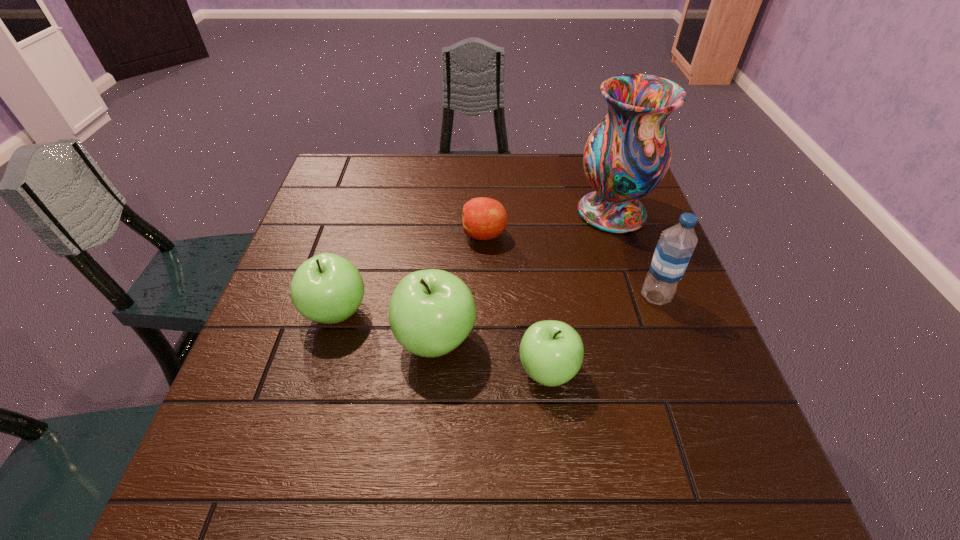
The width and height of the screenshot is (960, 540). Find the location of `vacant space at the far edge of the desktop`. vacant space at the far edge of the desktop is located at coordinates (492, 180).

In the image, there is a desktop. Where is `vacant space at the near edge`? vacant space at the near edge is located at coordinates (406, 416).

The height and width of the screenshot is (540, 960). What are the coordinates of `free space at the left edge of the desktop` in the screenshot? It's located at (315, 207).

Identify the location of blank space at the near left corner. (287, 418).

The height and width of the screenshot is (540, 960). What are the coordinates of `free space at the near right corner` in the screenshot? It's located at (686, 436).

Find the location of a particular element. The height and width of the screenshot is (540, 960). vacant area that lies between the water bottle and the rightmost apple is located at coordinates (602, 334).

The width and height of the screenshot is (960, 540). In order to click on unoccupied position between the leftmost apple and the tallest object in this screenshot , I will do `click(474, 262)`.

The image size is (960, 540). I want to click on vacant region between the third object from right to left and the vase, so click(x=580, y=292).

At what (x,y) coordinates should I click in order to perform the action: click on object that is the nearest to the fourth object from left to right. Please return your answer as a coordinate pair (x, y). Looking at the image, I should click on (431, 312).

Select which object appears as the closest to the fourth object from left to right. Please provide its 2D coordinates. Your answer should be formatted as a tuple, i.e. [(x, y)], where the tuple contains the x and y coordinates of a point satisfying the conditions above.

[(431, 312)]